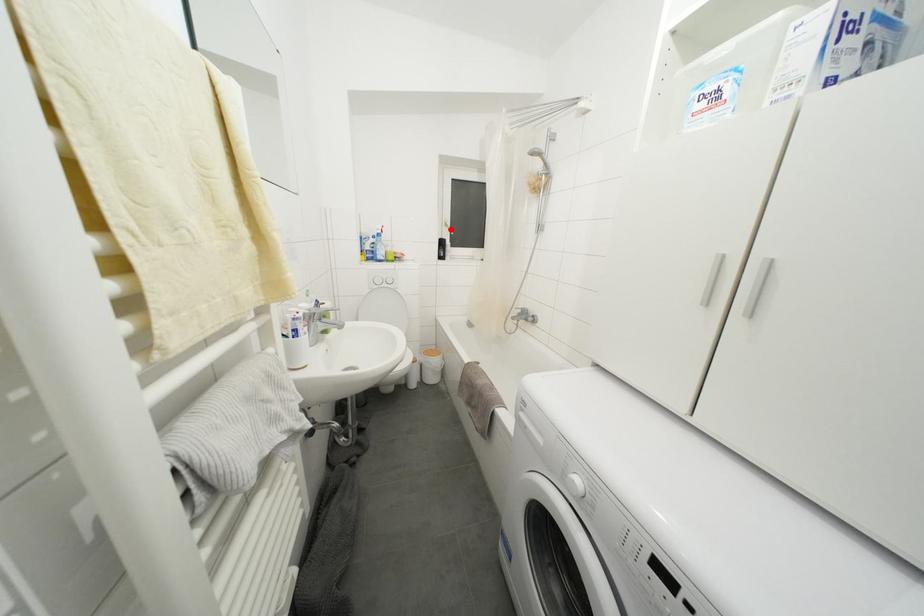
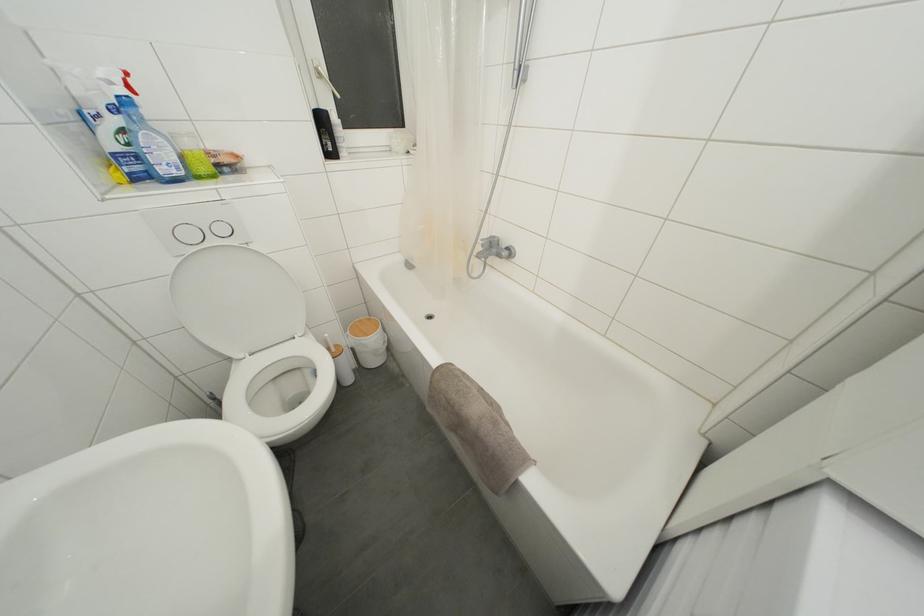
The point at the highlighted location is marked in the first image. Where is the corresponding point in the second image?

(323, 79)